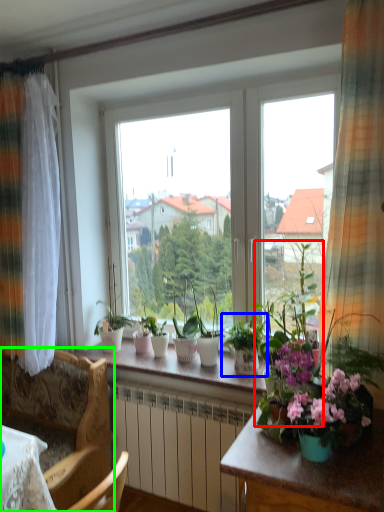
Question: Estimate the real-world distances between objects in this image. Which object is closer to houseplant (highlighted by a red box), houseplant (highlighted by a blue box) or chair (highlighted by a green box)?

Choices:
 (A) houseplant
 (B) chair

Answer: (A)